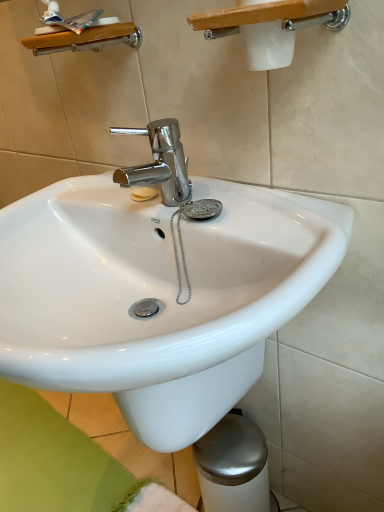
The width and height of the screenshot is (384, 512). In order to click on white glossy sink at center in this screenshot , I will do `click(157, 291)`.

You are a GUI agent. You are given a task and a screenshot of the screen. Output one action in this format:
    pyautogui.click(x=<x>, y=<y>)
    Task: Click on the white glossy sink at center
    The image size is (384, 512).
    Given the screenshot: What is the action you would take?
    pyautogui.click(x=157, y=291)

From the image's perspective, which one is positioned lower, wooden shelf at upper left, the first shower in the back-to-front sequence, or white plastic shower at upper center, which is the first shower in front-to-back order?

white plastic shower at upper center, which is the first shower in front-to-back order.

Is white plastic shower at upper center, the second shower in the left-to-right sequence, surrounded by wooden shelf at upper left, the first shower in the back-to-front sequence?

No, white plastic shower at upper center, the second shower in the left-to-right sequence, is not inside wooden shelf at upper left, the first shower in the back-to-front sequence.

Is wooden shelf at upper left, the second shower from the front, at the left side of white plastic shower at upper center, the second shower in the left-to-right sequence?

Yes.

What are the coordinates of `shower that appears above the white plastic shower at upper center, which is the first shower in front-to-back order (from the image's perspective)` in the screenshot? It's located at click(x=85, y=39).

From a real-world perspective, is white plastic shower at upper center, which is the first shower in front-to-back order, physically located above or below white glossy sink at center?

white plastic shower at upper center, which is the first shower in front-to-back order, is situated higher than white glossy sink at center in the real world.

How distant is white plastic shower at upper center, the second shower positioned from the back, from white glossy sink at center?

white plastic shower at upper center, the second shower positioned from the back, is 15.35 inches away from white glossy sink at center.

Which is behind, point (334, 27) or point (175, 292)?

Point (175, 292)

Considering the positions of objects white plastic shower at upper center, the 1th shower positioned from the right, and white glossy sink at center in the image provided, who is more to the right, white plastic shower at upper center, the 1th shower positioned from the right, or white glossy sink at center?

white plastic shower at upper center, the 1th shower positioned from the right.

Would you say wooden shelf at upper left, the first shower in the back-to-front sequence, is to the left or to the right of white glossy sink at center in the picture?

Based on their positions, wooden shelf at upper left, the first shower in the back-to-front sequence, is located to the left of white glossy sink at center.

Which of these two, wooden shelf at upper left, the 1th shower viewed from the left, or white glossy sink at center, is thinner?

With smaller width is wooden shelf at upper left, the 1th shower viewed from the left.

From the image's perspective, which shower is the 2nd one above the white glossy sink at center? Please provide its 2D coordinates.

[(85, 39)]

Are wooden shelf at upper left, the 1th shower viewed from the left, and white glossy sink at center making contact?

wooden shelf at upper left, the 1th shower viewed from the left, is not next to white glossy sink at center, and they're not touching.

Are white plastic shower at upper center, the 1th shower positioned from the right, and wooden shelf at upper left, which is the 2th shower in right-to-left order, located far from each other?

They are positioned close to each other.

Is white plastic shower at upper center, which is the first shower in front-to-back order, completely or partially outside of wooden shelf at upper left, which is the 2th shower in right-to-left order?

white plastic shower at upper center, which is the first shower in front-to-back order, lies outside wooden shelf at upper left, which is the 2th shower in right-to-left order,'s area.

Looking at the image, does white plastic shower at upper center, the second shower in the left-to-right sequence, seem bigger or smaller compared to wooden shelf at upper left, the first shower in the back-to-front sequence?

Considering their sizes, white plastic shower at upper center, the second shower in the left-to-right sequence, takes up more space than wooden shelf at upper left, the first shower in the back-to-front sequence.

From the image's perspective, is white glossy sink at center on white plastic shower at upper center, which is the first shower in front-to-back order?

No.

Between white glossy sink at center and white plastic shower at upper center, which is the first shower in front-to-back order, which one has less height?

Standing shorter between the two is white plastic shower at upper center, which is the first shower in front-to-back order.

Based on the photo, how much distance is there between white glossy sink at center and white plastic shower at upper center, the 1th shower positioned from the right?

white glossy sink at center and white plastic shower at upper center, the 1th shower positioned from the right, are 15.35 inches apart from each other.

Considering the positions of objects white glossy sink at center and wooden shelf at upper left, the first shower in the back-to-front sequence, in the image provided, who is more to the right, white glossy sink at center or wooden shelf at upper left, the first shower in the back-to-front sequence,?

white glossy sink at center is more to the right.

From the image's perspective, is white glossy sink at center above wooden shelf at upper left, the 1th shower viewed from the left?

Incorrect, from the image's perspective, white glossy sink at center is lower than wooden shelf at upper left, the 1th shower viewed from the left.

Looking at this image, is white glossy sink at center further to camera compared to wooden shelf at upper left, the 1th shower viewed from the left?

No, it is not.

Considering the sizes of objects white glossy sink at center and wooden shelf at upper left, the 1th shower viewed from the left, in the image provided, who is bigger, white glossy sink at center or wooden shelf at upper left, the 1th shower viewed from the left,?

Bigger between the two is white glossy sink at center.

At what (x,y) coordinates should I click in order to perform the action: click on shower located on the left of white plastic shower at upper center, the second shower positioned from the back. Please return your answer as a coordinate pair (x, y). This screenshot has width=384, height=512. Looking at the image, I should click on (85, 39).

Locate an element on the screen. This screenshot has height=512, width=384. sink below the white plastic shower at upper center, which is the first shower in front-to-back order (from the image's perspective) is located at coordinates (157, 291).

When comparing their distances from wooden shelf at upper left, the 1th shower viewed from the left, does white glossy sink at center or white plastic shower at upper center, the second shower positioned from the back, seem closer?

white plastic shower at upper center, the second shower positioned from the back, is positioned closer to the anchor wooden shelf at upper left, the 1th shower viewed from the left.

Considering their positions, is wooden shelf at upper left, the first shower in the back-to-front sequence, positioned further to white plastic shower at upper center, the second shower in the left-to-right sequence, than white glossy sink at center?

white glossy sink at center lies further to white plastic shower at upper center, the second shower in the left-to-right sequence, than the other object.

Looking at the image, which one is located closer to white plastic shower at upper center, the second shower in the left-to-right sequence, white glossy sink at center or wooden shelf at upper left, which is the 2th shower in right-to-left order?

Among the two, wooden shelf at upper left, which is the 2th shower in right-to-left order, is located nearer to white plastic shower at upper center, the second shower in the left-to-right sequence.

Considering their positions, is wooden shelf at upper left, the second shower from the front, positioned further to white glossy sink at center than white plastic shower at upper center, the second shower in the left-to-right sequence?

The object further to white glossy sink at center is wooden shelf at upper left, the second shower from the front.

Looking at the image, which one is located further to wooden shelf at upper left, the 1th shower viewed from the left, white plastic shower at upper center, which is the first shower in front-to-back order, or white glossy sink at center?

white glossy sink at center lies further to wooden shelf at upper left, the 1th shower viewed from the left, than the other object.

When comparing their distances from white glossy sink at center, does white plastic shower at upper center, the second shower positioned from the back, or wooden shelf at upper left, the second shower from the front, seem further?

The object further to white glossy sink at center is wooden shelf at upper left, the second shower from the front.

In order to click on shower between wooden shelf at upper left, the 1th shower viewed from the left, and white glossy sink at center in the up-down direction in this screenshot , I will do `click(321, 20)`.